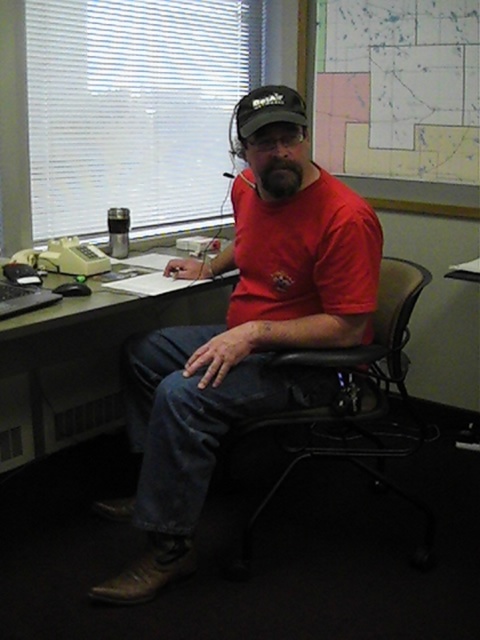
This screenshot has width=480, height=640. What do you see at coordinates (79, 364) in the screenshot? I see `matte black desk at center` at bounding box center [79, 364].

Does matte black desk at center appear on the right side of black plastic chair at center?

Incorrect, matte black desk at center is not on the right side of black plastic chair at center.

Is point (84, 307) behind point (424, 512)?

No, (84, 307) is in front of (424, 512).

The height and width of the screenshot is (640, 480). I want to click on matte black desk at center, so click(79, 364).

Consider the image. Can you confirm if red matte shirt at center is positioned above matte black desk at center?

Yes.

Does red matte shirt at center have a larger size compared to matte black desk at center?

Correct, red matte shirt at center is larger in size than matte black desk at center.

This screenshot has height=640, width=480. What are the coordinates of `red matte shirt at center` in the screenshot? It's located at (x=243, y=330).

Which is below, matte black desk at center or map paper at upper right?

matte black desk at center

Is matte black desk at center to the left of map paper at upper right from the viewer's perspective?

Correct, you'll find matte black desk at center to the left of map paper at upper right.

Measure the distance between matte black desk at center and camera.

A distance of 2.31 meters exists between matte black desk at center and camera.

Identify the location of matte black desk at center. (79, 364).